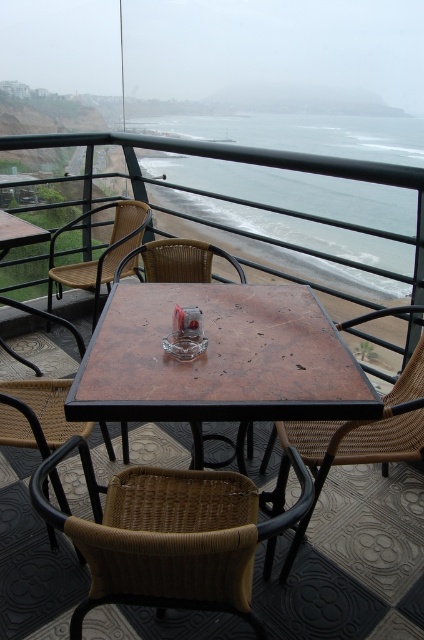
Is point (410, 422) positioned behind point (49, 417)?

No, (410, 422) is in front of (49, 417).

Is woven wicker chair at center below woven rattan chair at lower left?

Yes.

Who is more distant from viewer, (320, 432) or (38, 400)?

Point (38, 400)

Identify the location of woven wicker chair at center. This screenshot has width=424, height=640. (357, 438).

What are the coordinates of `woven wicker chair at center` in the screenshot? It's located at (357, 438).

Is point (351, 456) in front of point (161, 243)?

Yes, it is in front of point (161, 243).

Identify the location of woven wicker chair at center. (x=357, y=438).

Can you confirm if clear water at center is bigger than woven wicker chair at center?

Yes.

The height and width of the screenshot is (640, 424). What do you see at coordinates (292, 189) in the screenshot?
I see `clear water at center` at bounding box center [292, 189].

Identify the location of clear water at center. (292, 189).